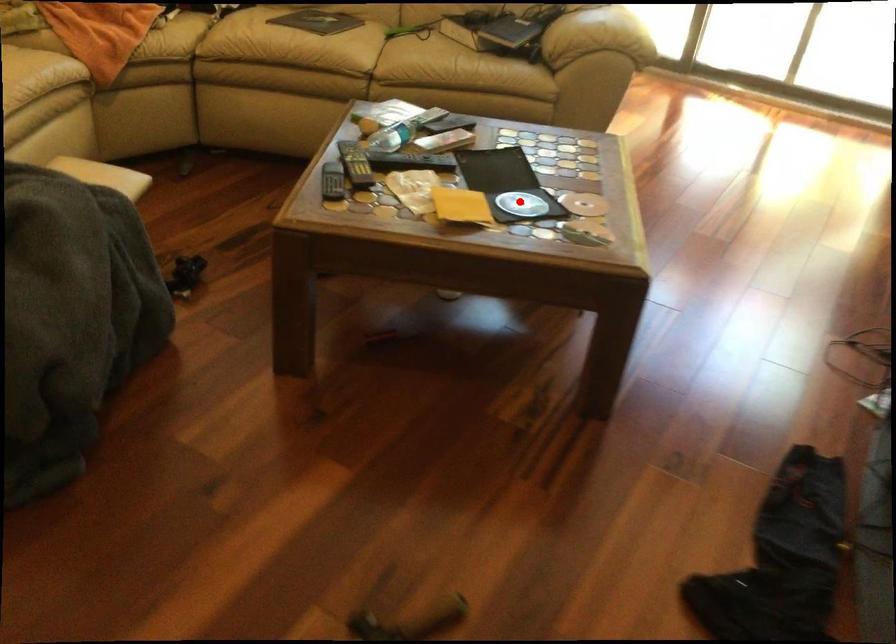
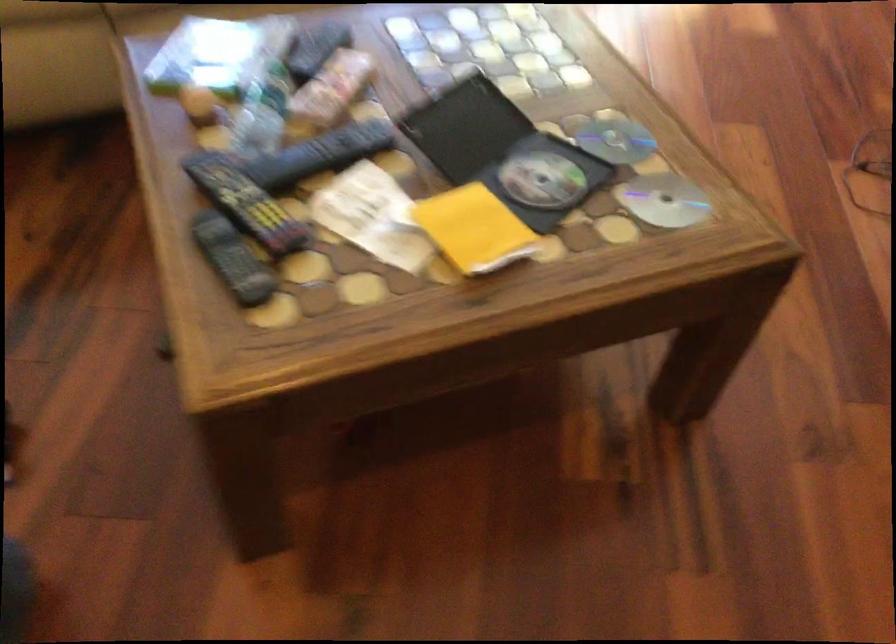
Locate, in the second image, the point that corresponds to the highlighted location in the first image.

(541, 180)